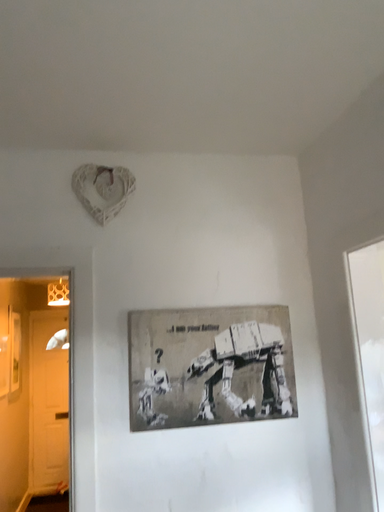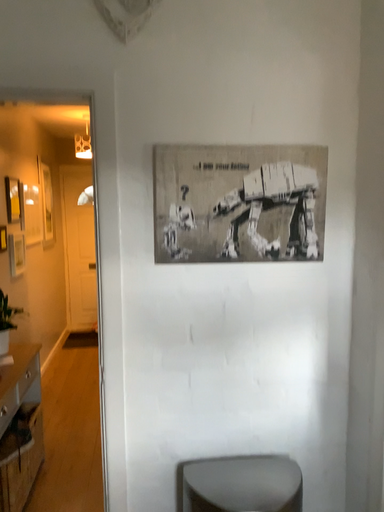
Question: Which way did the camera rotate in the video?

Choices:
 (A) rotated upward
 (B) rotated downward

Answer: (B)